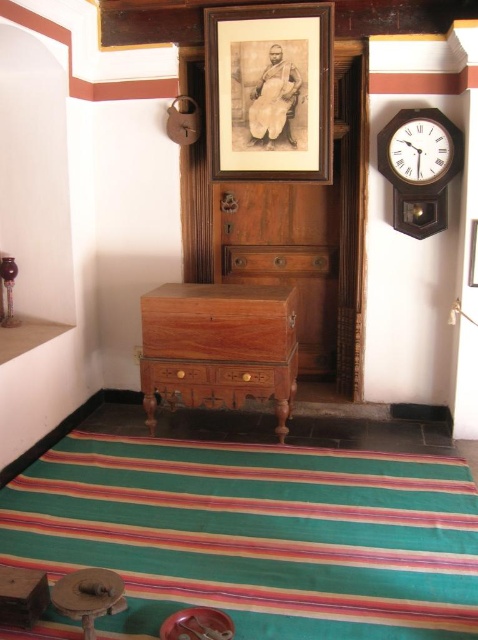
Does striped fabric mat at lower center lie in front of wooden drawer at center?

Yes, it is in front of wooden drawer at center.

Is point (102, 534) less distant than point (246, 371)?

Yes, it is.

Where is `striped fabric mat at lower center`? This screenshot has width=478, height=640. striped fabric mat at lower center is located at coordinates (257, 534).

Between wooden clock at upper right and wooden picture frame at upper center, which one is positioned higher?

wooden clock at upper right is above.

Is wooden clock at upper right above wooden picture frame at upper center?

Yes, wooden clock at upper right is above wooden picture frame at upper center.

Is point (445, 131) positioned before point (474, 228)?

No, it is behind (474, 228).

The image size is (478, 640). What are the coordinates of `wooden clock at upper right` in the screenshot? It's located at (420, 168).

Is point (281, 269) positioned in front of point (221, 376)?

No.

Find the location of a particular element. The width and height of the screenshot is (478, 640). brown wood drawer at center is located at coordinates (278, 260).

This screenshot has height=640, width=478. Find the location of `brown wood drawer at center`. brown wood drawer at center is located at coordinates (278, 260).

I want to click on brown wood drawer at center, so click(x=278, y=260).